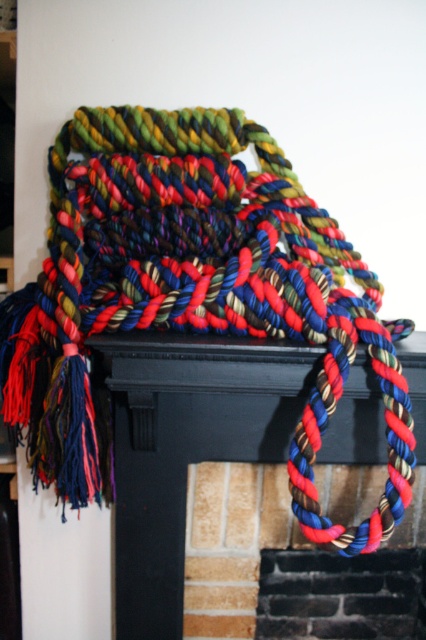
Does braided multicolored rope at center have a larger size compared to multicolored braided rope at center?

Yes, braided multicolored rope at center is bigger than multicolored braided rope at center.

In the scene shown: Who is higher up, braided multicolored rope at center or multicolored braided rope at center?

Positioned higher is braided multicolored rope at center.

Which is behind, point (80, 376) or point (198, 340)?

Point (80, 376)

Where is `braided multicolored rope at center`? Image resolution: width=426 pixels, height=640 pixels. braided multicolored rope at center is located at coordinates (193, 285).